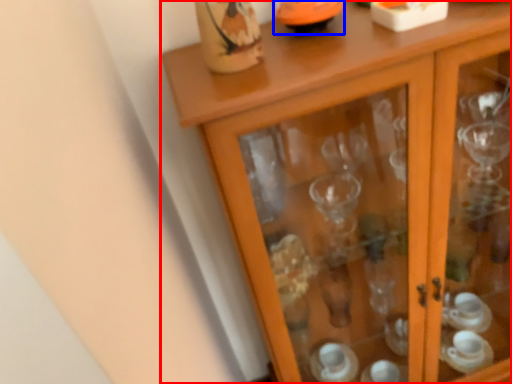
Question: Among these objects, which one is farthest to the camera, cupboard (highlighted by a red box) or tableware (highlighted by a blue box)?

Choices:
 (A) cupboard
 (B) tableware

Answer: (B)